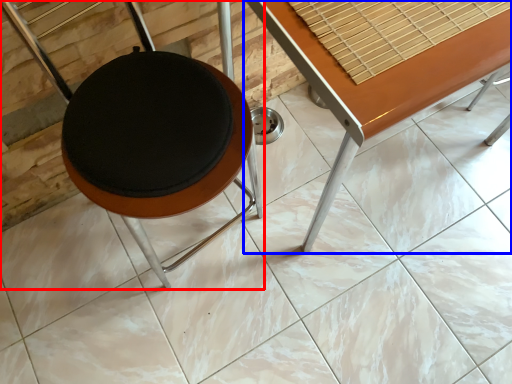
Question: Which object appears closest to the camera in this image, furniture (highlighted by a red box) or table (highlighted by a blue box)?

Choices:
 (A) furniture
 (B) table

Answer: (A)